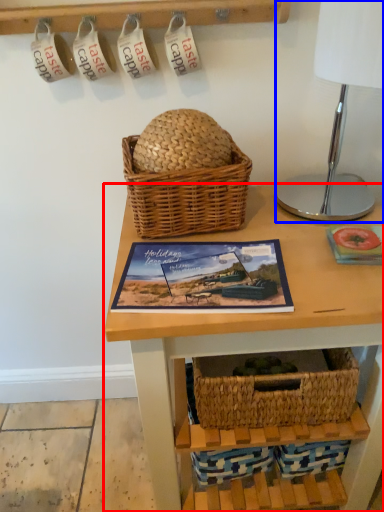
Question: Which of the following is the farthest to the observer, table (highlighted by a red box) or table lamp (highlighted by a blue box)?

Choices:
 (A) table
 (B) table lamp

Answer: (A)